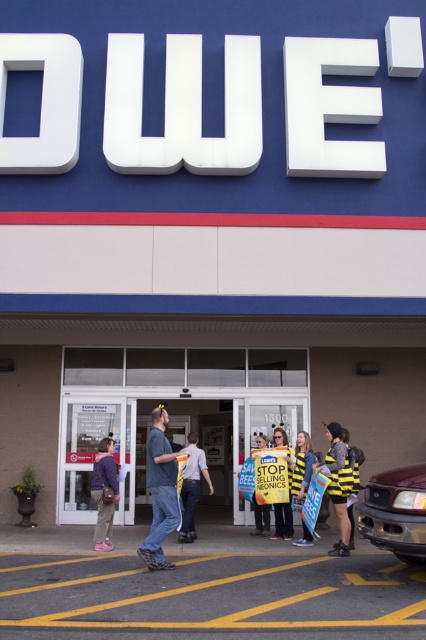
Question: Which object appears farthest from the camera in this image?

Choices:
 (A) bee costume at center
 (B) denim jeans at center
 (C) yellow bee-patterned vest at center
 (D) matte red truck at lower right

Answer: (C)

Question: Is denim jeans at center further to camera compared to yellow bee-patterned vest at center?

Choices:
 (A) yes
 (B) no

Answer: (B)

Question: Does bee costume at center appear over yellow bee-patterned vest at center?

Choices:
 (A) no
 (B) yes

Answer: (B)

Question: Is matte red truck at lower right to the left of yellow bee-patterned vest at center from the viewer's perspective?

Choices:
 (A) yes
 (B) no

Answer: (B)

Question: Which point is farther to the camera?

Choices:
 (A) (305, 467)
 (B) (281, 440)
 (C) (155, 499)

Answer: (B)

Question: Which point is farther to the camera?

Choices:
 (A) (278, 531)
 (B) (293, 477)
 (C) (172, 504)

Answer: (A)